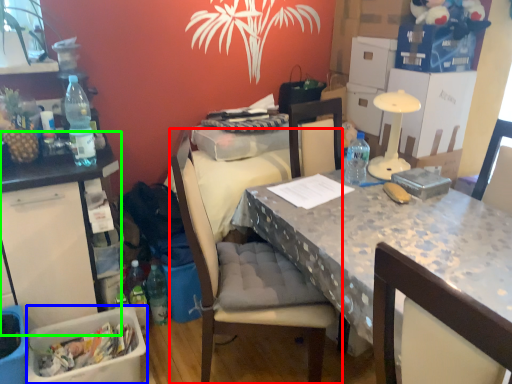
Question: Estimate the real-world distances between objects in this image. Which object is closer to chair (highlighted by a red box), box (highlighted by a blue box) or table (highlighted by a green box)?

Choices:
 (A) box
 (B) table

Answer: (A)